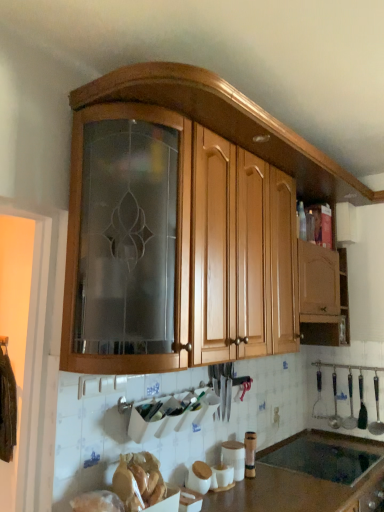
You are a GUI agent. You are given a task and a screenshot of the screen. Output one action in this format:
    pyautogui.click(x=<x>, y=<y>)
    Task: Click on the free point to the left of metallic silver spoon at lower right, marked as the 1th silverware in a left-to-right arrangement
    This screenshot has width=384, height=512.
    Given the screenshot: What is the action you would take?
    pyautogui.click(x=327, y=436)